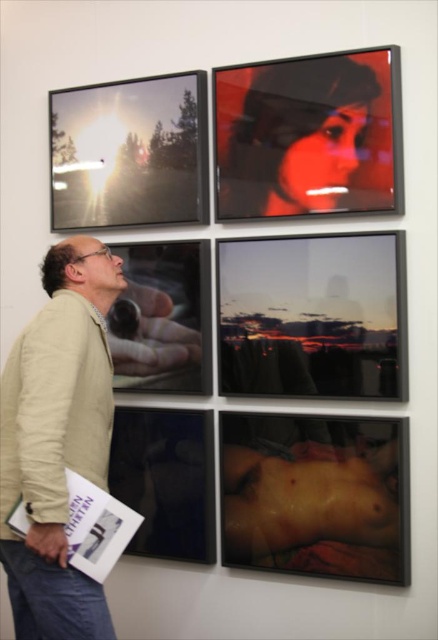
Can you confirm if beige cotton jacket at lower left is positioned above metallic reflective screen at upper left?

Incorrect, beige cotton jacket at lower left is not positioned above metallic reflective screen at upper left.

Is beige cotton jacket at lower left below metallic reflective screen at upper left?

Correct, beige cotton jacket at lower left is located below metallic reflective screen at upper left.

Is point (14, 352) farther from camera compared to point (205, 164)?

That is False.

I want to click on beige cotton jacket at lower left, so pyautogui.click(x=57, y=440).

Who is taller, matte glass sunset at center or smooth skin at lower right?

smooth skin at lower right

Is matte glass sunset at center shorter than smooth skin at lower right?

Indeed, matte glass sunset at center has a lesser height compared to smooth skin at lower right.

This screenshot has height=640, width=438. Describe the element at coordinates (313, 316) in the screenshot. I see `matte glass sunset at center` at that location.

Find the location of a particular element. Image resolution: width=438 pixels, height=640 pixels. matte glass sunset at center is located at coordinates (313, 316).

Is point (389, 141) farther from viewer compared to point (208, 364)?

No, (389, 141) is in front of (208, 364).

The height and width of the screenshot is (640, 438). In order to click on matte black portrait at upper center in this screenshot , I will do (308, 134).